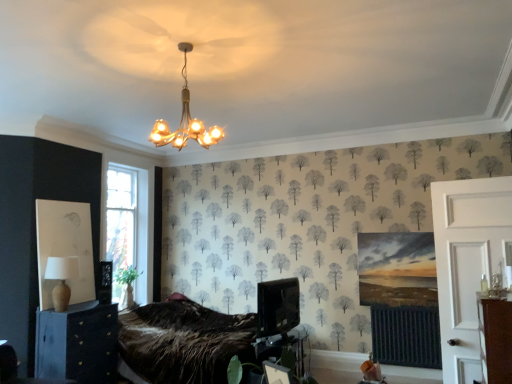
Describe the element at coordinates (281, 350) in the screenshot. I see `metallic silver table at lower center` at that location.

What are the coordinates of `white wooden door at right` in the screenshot? It's located at (468, 263).

The image size is (512, 384). Describe the element at coordinates (185, 120) in the screenshot. I see `gold metallic chandelier at upper center` at that location.

Locate an element on the screen. This screenshot has width=512, height=384. metallic silver table at lower center is located at coordinates (281, 350).

Looking at this image, relative to white wooden door at right, is metallic silver table at lower center in front or behind?

metallic silver table at lower center is behind white wooden door at right.

How far apart are metallic silver table at lower center and white wooden door at right?

They are 6.60 feet apart.

Would you say metallic silver table at lower center contains white wooden door at right?

Actually, white wooden door at right is outside metallic silver table at lower center.

Is metallic silver table at lower center beside white wooden door at right?

There is a gap between metallic silver table at lower center and white wooden door at right.

Is metallic silver table at lower center far from gold metallic chandelier at upper center?

Yes, metallic silver table at lower center and gold metallic chandelier at upper center are quite far apart.

Looking at this image, does metallic silver table at lower center turn towards gold metallic chandelier at upper center?

No, metallic silver table at lower center is not oriented towards gold metallic chandelier at upper center.

Does metallic silver table at lower center have a greater width compared to gold metallic chandelier at upper center?

Incorrect, the width of metallic silver table at lower center does not surpass that of gold metallic chandelier at upper center.

Is point (261, 338) in front of point (151, 137)?

Yes.

From the image's perspective, is gold metallic chandelier at upper center located beneath beige fabric lampshade at lower left?

Actually, gold metallic chandelier at upper center appears above beige fabric lampshade at lower left in the image.

Is there a large distance between gold metallic chandelier at upper center and beige fabric lampshade at lower left?

gold metallic chandelier at upper center is positioned a significant distance from beige fabric lampshade at lower left.

Which is in front, point (154, 132) or point (72, 262)?

The point (72, 262) is closer.

Is gold metallic chandelier at upper center wider than white wooden door at right?

Correct, the width of gold metallic chandelier at upper center exceeds that of white wooden door at right.

Does gold metallic chandelier at upper center have a smaller size compared to white wooden door at right?

Indeed, gold metallic chandelier at upper center has a smaller size compared to white wooden door at right.

Is the depth of gold metallic chandelier at upper center greater than that of white wooden door at right?

No, gold metallic chandelier at upper center is closer to the camera.

Is gold metallic chandelier at upper center oriented away from white wooden door at right?

gold metallic chandelier at upper center does not have its back to white wooden door at right.

Is matte black cabinet at lower left at the right side of white wooden door at right?

No, matte black cabinet at lower left is not to the right of white wooden door at right.

Does matte black cabinet at lower left turn towards white wooden door at right?

Yes, matte black cabinet at lower left is facing white wooden door at right.

In the image, there is a matte black cabinet at lower left. At what (x,y) coordinates should I click in order to perform the action: click on side above it (from the image's perspective). Please return your answer as a coordinate pair (x, y). Image resolution: width=512 pixels, height=384 pixels. Looking at the image, I should click on (468, 263).

Considering the sizes of matte black cabinet at lower left and white wooden door at right in the image, is matte black cabinet at lower left taller or shorter than white wooden door at right?

In the image, matte black cabinet at lower left appears to be shorter than white wooden door at right.

Is matte black cabinet at lower left wider than beige fabric lampshade at lower left?

Correct, the width of matte black cabinet at lower left exceeds that of beige fabric lampshade at lower left.

Who is more distant, matte black cabinet at lower left or beige fabric lampshade at lower left?

beige fabric lampshade at lower left is further from the camera.

Consider the image. Between matte black cabinet at lower left and beige fabric lampshade at lower left, which one has more height?

With more height is matte black cabinet at lower left.

From a real-world perspective, is matte black cabinet at lower left under beige fabric lampshade at lower left?

Yes.

Is gold metallic chandelier at upper center shorter than metallic silver table at lower center?

No.

Does gold metallic chandelier at upper center have a lesser width compared to metallic silver table at lower center?

No, gold metallic chandelier at upper center is not thinner than metallic silver table at lower center.

From the image's perspective, relative to metallic silver table at lower center, is gold metallic chandelier at upper center above or below?

Based on their image positions, gold metallic chandelier at upper center is located above metallic silver table at lower center.

Is gold metallic chandelier at upper center not near metallic silver table at lower center?

Yes.

This screenshot has height=384, width=512. Find the location of `table beneath the white wooden door at right (from a real-world perspective)`. table beneath the white wooden door at right (from a real-world perspective) is located at coordinates (281, 350).

The width and height of the screenshot is (512, 384). Find the location of `table behind the gold metallic chandelier at upper center`. table behind the gold metallic chandelier at upper center is located at coordinates (281, 350).

Considering their positions, is gold metallic chandelier at upper center positioned further to beige fabric lampshade at lower left than matte black cabinet at lower left?

gold metallic chandelier at upper center is positioned further to the anchor beige fabric lampshade at lower left.

Based on their spatial positions, is matte black cabinet at lower left or gold metallic chandelier at upper center further from metallic silver table at lower center?

gold metallic chandelier at upper center is further to metallic silver table at lower center.

Based on their spatial positions, is white wooden door at right or metallic silver table at lower center closer to gold metallic chandelier at upper center?

Among the two, metallic silver table at lower center is located nearer to gold metallic chandelier at upper center.

From the picture: When comparing their distances from metallic silver table at lower center, does matte black cabinet at lower left or beige fabric lampshade at lower left seem further?

beige fabric lampshade at lower left is positioned further to the anchor metallic silver table at lower center.

Estimate the real-world distances between objects in this image. Which object is further from matte black cabinet at lower left, gold metallic chandelier at upper center or beige fabric lampshade at lower left?

gold metallic chandelier at upper center is positioned further to the anchor matte black cabinet at lower left.

Looking at the image, which one is located closer to matte black cabinet at lower left, metallic silver table at lower center or white wooden door at right?

Among the two, metallic silver table at lower center is located nearer to matte black cabinet at lower left.

Estimate the real-world distances between objects in this image. Which object is closer to white wooden door at right, metallic silver table at lower center or beige fabric lampshade at lower left?

metallic silver table at lower center.

Based on their spatial positions, is gold metallic chandelier at upper center or beige fabric lampshade at lower left further from white wooden door at right?

beige fabric lampshade at lower left.

Find the location of a particular element. The width and height of the screenshot is (512, 384). side between gold metallic chandelier at upper center and metallic silver table at lower center in the vertical direction is located at coordinates (468, 263).

Find the location of a particular element. Image resolution: width=512 pixels, height=384 pixels. table situated between matte black cabinet at lower left and white wooden door at right from left to right is located at coordinates (281, 350).

Image resolution: width=512 pixels, height=384 pixels. In order to click on table lamp between gold metallic chandelier at upper center and matte black cabinet at lower left vertically in this screenshot , I will do `click(61, 279)`.

Locate an element on the screen. Image resolution: width=512 pixels, height=384 pixels. table between beige fabric lampshade at lower left and white wooden door at right is located at coordinates (281, 350).